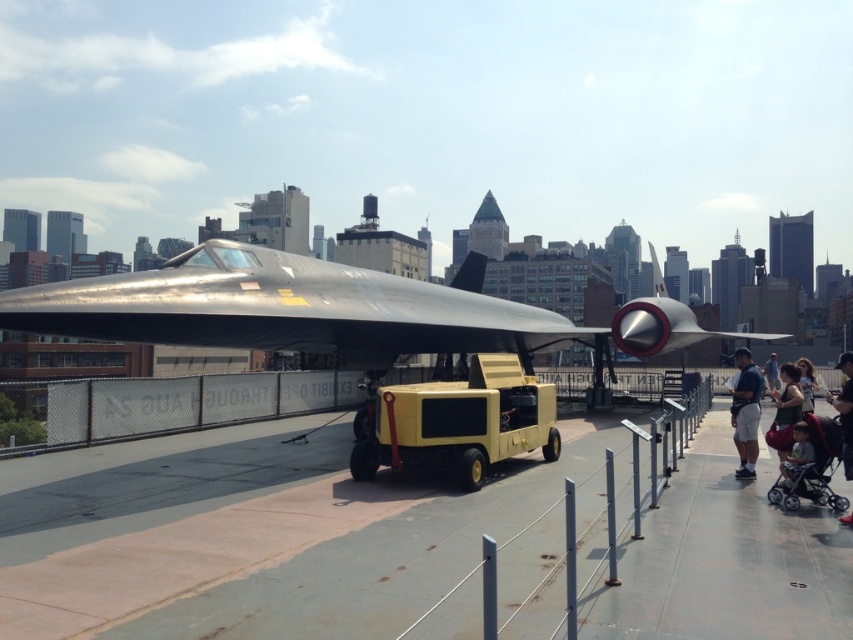
Can you confirm if light brown fabric stroller at lower right is thinner than light brown leather jacket at center?

Correct, light brown fabric stroller at lower right's width is less than light brown leather jacket at center's.

Between light brown fabric stroller at lower right and light brown leather jacket at center, which one has less height?

With less height is light brown fabric stroller at lower right.

Describe the element at coordinates (796, 456) in the screenshot. This screenshot has height=640, width=853. I see `light brown fabric stroller at lower right` at that location.

You are a GUI agent. You are given a task and a screenshot of the screen. Output one action in this format:
    pyautogui.click(x=<x>, y=<y>)
    Task: Click on the light brown fabric stroller at lower right
    
    Given the screenshot: What is the action you would take?
    pyautogui.click(x=796, y=456)

Does dark brown hair at lower right appear on the left side of light brown leather jacket at center?

Answer: Indeed, dark brown hair at lower right is positioned on the left side of light brown leather jacket at center.

Is dark brown hair at lower right below light brown leather jacket at center?

Actually, dark brown hair at lower right is above light brown leather jacket at center.

The height and width of the screenshot is (640, 853). I want to click on dark brown hair at lower right, so click(844, 410).

Which of these two, dark brown hair at center or light brown fabric stroller at lower right, stands taller?

Standing taller between the two is dark brown hair at center.

Who is shorter, dark brown hair at center or light brown fabric stroller at lower right?

Standing shorter between the two is light brown fabric stroller at lower right.

The image size is (853, 640). What do you see at coordinates (785, 410) in the screenshot? I see `dark brown hair at center` at bounding box center [785, 410].

The height and width of the screenshot is (640, 853). I want to click on dark brown hair at center, so click(785, 410).